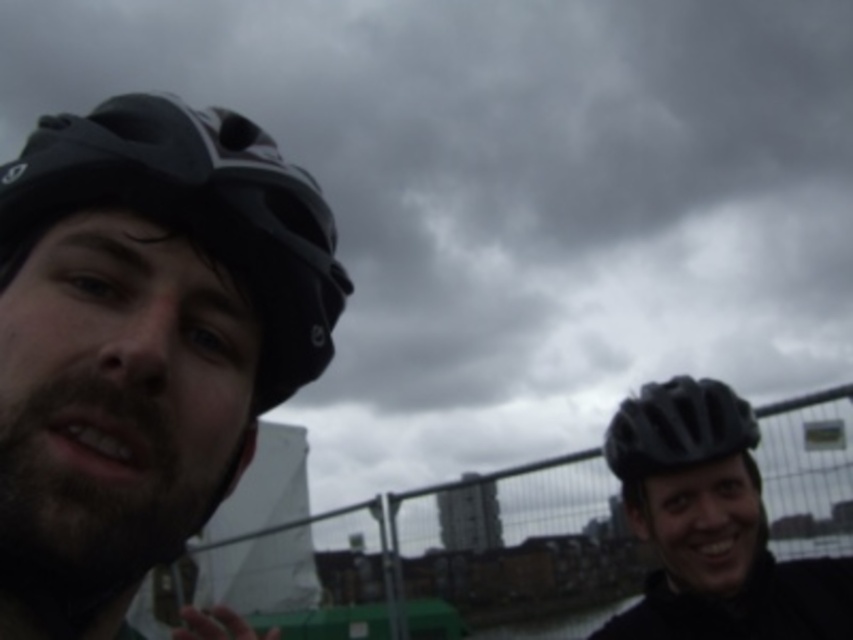
Is matte black helmet at left behind matte black helmet at right?

No.

Consider the image. Does matte black helmet at left have a lesser height compared to matte black helmet at right?

No, matte black helmet at left is not shorter than matte black helmet at right.

Does point (26, 554) come in front of point (650, 465)?

Yes, point (26, 554) is closer to viewer.

I want to click on matte black helmet at left, so click(x=142, y=342).

Is point (248, 369) positioned in front of point (815, 564)?

That is True.

Can you confirm if matte black helmet at left is thinner than matte black helmet at center?

Correct, matte black helmet at left's width is less than matte black helmet at center's.

Identify the location of matte black helmet at left. (142, 342).

This screenshot has height=640, width=853. I want to click on matte black helmet at left, so point(142,342).

Is matte black helmet at center positioned behind matte black helmet at right?

No, it is in front of matte black helmet at right.

Measure the distance between matte black helmet at center and camera.

The distance of matte black helmet at center from camera is 4.98 feet.

Image resolution: width=853 pixels, height=640 pixels. In order to click on matte black helmet at center in this screenshot , I will do `click(711, 525)`.